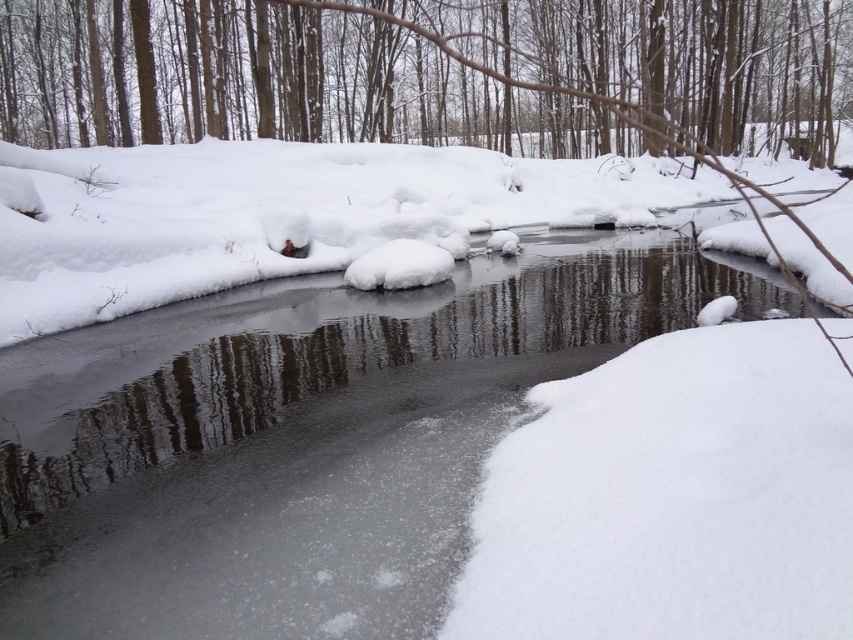
Can you confirm if clear ice stream at center is positioned below smooth bark tree at upper center?

Indeed, clear ice stream at center is positioned under smooth bark tree at upper center.

Is clear ice stream at center to the left of smooth bark tree at upper center from the viewer's perspective?

Indeed, clear ice stream at center is positioned on the left side of smooth bark tree at upper center.

Is point (460, 275) in front of point (137, 138)?

Yes.

Where is `clear ice stream at center`? This screenshot has height=640, width=853. clear ice stream at center is located at coordinates (300, 440).